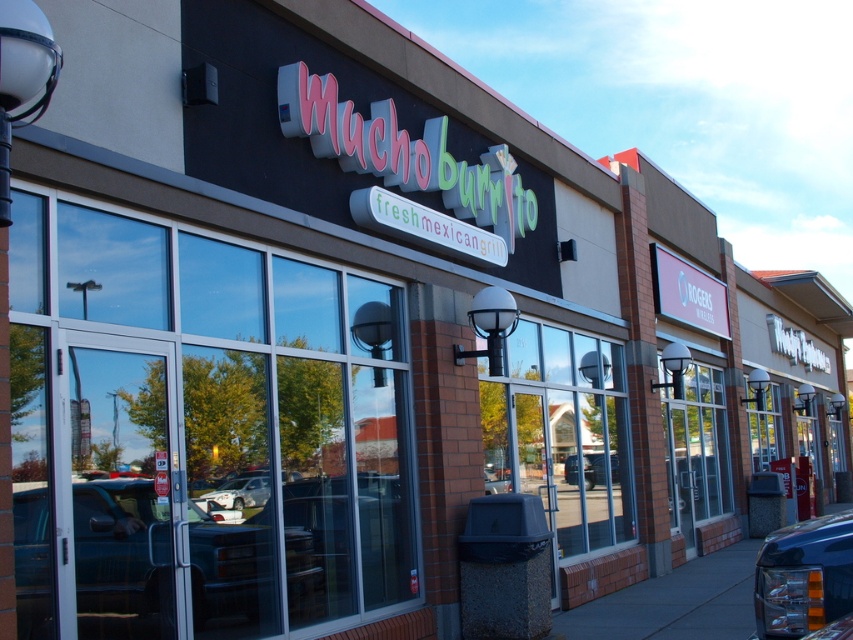
Question: Can you confirm if shiny black car at center is wider than metallic silver sedan at center?

Choices:
 (A) yes
 (B) no

Answer: (A)

Question: Is gray concrete sidewalk at lower right above silver metallic car at center?

Choices:
 (A) yes
 (B) no

Answer: (B)

Question: Is shiny black car at center positioned before metallic blue truck at lower right?

Choices:
 (A) yes
 (B) no

Answer: (B)

Question: Estimate the real-world distances between objects in this image. Which object is farther from the metallic silver sedan at center?

Choices:
 (A) silver metallic car at center
 (B) metallic blue truck at lower right

Answer: (B)

Question: Which point is closer to the camera?

Choices:
 (A) (248, 476)
 (B) (738, 586)
 (C) (805, 632)

Answer: (C)

Question: Which is farther from the shiny black car at center?

Choices:
 (A) silver metallic car at center
 (B) metallic silver sedan at center
 (C) metallic blue truck at lower right

Answer: (B)